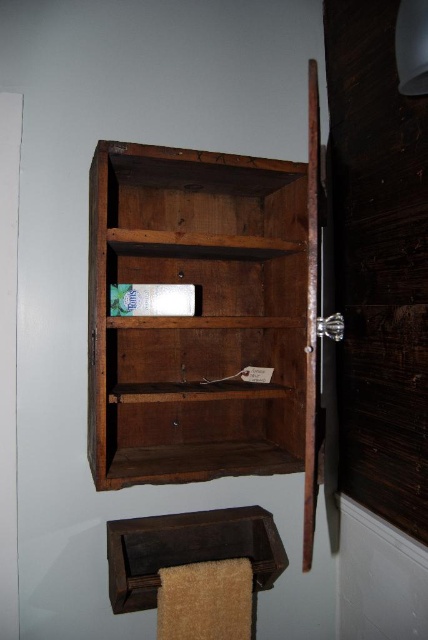
You are trying to decide whether to place a large dictionary on the wooden bookshelf at center or the dark brown wood towel rack at lower center. Which object can accommodate the dictionary based on their widths?

The wooden bookshelf at center is wider than the dark brown wood towel rack at lower center, so the dictionary can fit on the wooden bookshelf at center.

You are a delivery person trying to place a package that is 40 centimeters wide between the wooden bookshelf at center and the dark brown wood towel rack at lower center. Can you fit the package in that space?

The distance between the wooden bookshelf at center and the dark brown wood towel rack at lower center is 39.52 centimeters. Since the package is 40 centimeters wide, it is slightly wider than the available space. Therefore, the package cannot fit between them.

You are organizing a small bookshelf and need to place both the wooden bookshelf at center and the dark brown wood towel rack at lower center in a narrow hallway. Which object should you place first to ensure they both fit?

The wooden bookshelf at center is larger in size than the dark brown wood towel rack at lower center. Therefore, you should place the wooden bookshelf at center first to accommodate its larger size before fitting the smaller dark brown wood towel rack at lower center into the remaining space.